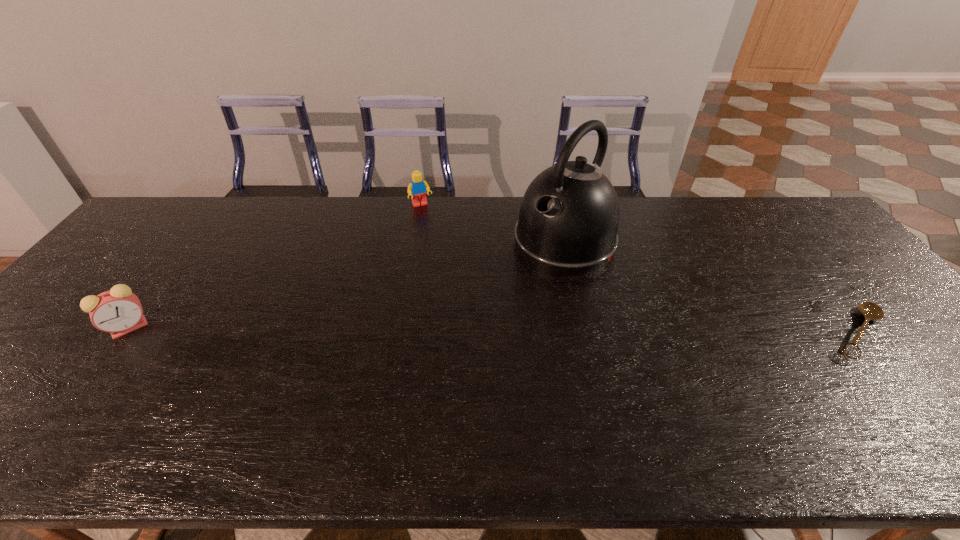
The width and height of the screenshot is (960, 540). Identify the location of free space between the farthest object and the alarm clock. (276, 266).

You are a GUI agent. You are given a task and a screenshot of the screen. Output one action in this format:
    pyautogui.click(x=<x>, y=<y>)
    Task: Click on the empty space that is in between the rightmost object and the tallest object
    Image resolution: width=960 pixels, height=540 pixels.
    Given the screenshot: What is the action you would take?
    pyautogui.click(x=711, y=287)

Where is `vacant area that lies between the leftmost object and the shortest object`? The image size is (960, 540). vacant area that lies between the leftmost object and the shortest object is located at coordinates (493, 330).

Locate an element on the screen. The image size is (960, 540). empty space between the rightmost object and the alarm clock is located at coordinates (493, 330).

At what (x,y) coordinates should I click in order to perform the action: click on the third closest object to the leftmost object. Please return your answer as a coordinate pair (x, y). Image resolution: width=960 pixels, height=540 pixels. Looking at the image, I should click on (871, 311).

Identify the location of the closest object to the second object from right to left. (417, 188).

This screenshot has height=540, width=960. Find the location of `free location that satisfies the following two spatial constraints: 1. on the face of the alarm clock; 2. on the left side of the ladle`. free location that satisfies the following two spatial constraints: 1. on the face of the alarm clock; 2. on the left side of the ladle is located at coordinates (125, 333).

The height and width of the screenshot is (540, 960). In order to click on free location that satisfies the following two spatial constraints: 1. on the face of the leftmost object; 2. on the right side of the ladle in this screenshot , I will do `click(125, 333)`.

You are a GUI agent. You are given a task and a screenshot of the screen. Output one action in this format:
    pyautogui.click(x=<x>, y=<y>)
    Task: Click on the free space in the image that satisfies the following two spatial constraints: 1. on the face of the alarm clock; 2. on the right side of the ladle
    
    Given the screenshot: What is the action you would take?
    pyautogui.click(x=125, y=333)

Identify the location of free location that satisfies the following two spatial constraints: 1. on the front side of the third nearest object; 2. on the left side of the Lego. The width and height of the screenshot is (960, 540). pos(416,241).